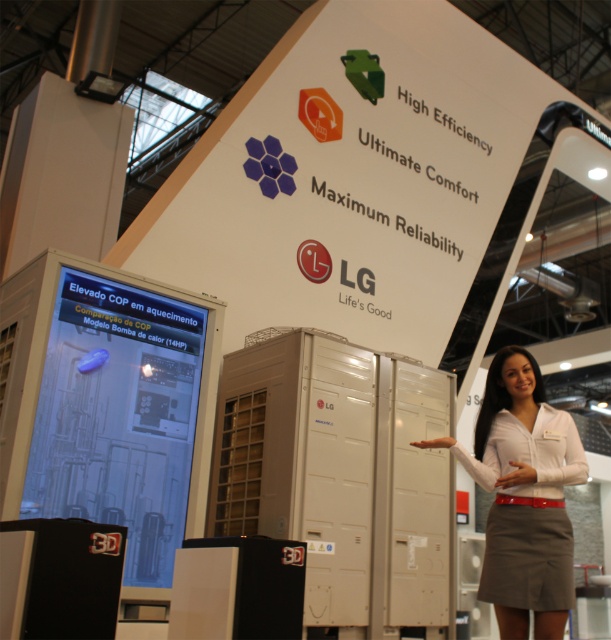
Question: Is white paper at upper center further to the viewer compared to white fabric shirt at center?

Choices:
 (A) yes
 (B) no

Answer: (A)

Question: Is the position of white paper at upper center more distant than that of white fabric shirt at center?

Choices:
 (A) no
 (B) yes

Answer: (B)

Question: Which object is closer to the camera taking this photo?

Choices:
 (A) white fabric shirt at center
 (B) white paper at upper center

Answer: (A)

Question: Is white paper at upper center below white fabric shirt at center?

Choices:
 (A) no
 (B) yes

Answer: (A)

Question: Which object is farther from the camera taking this photo?

Choices:
 (A) white paper at upper center
 (B) white fabric shirt at center

Answer: (A)